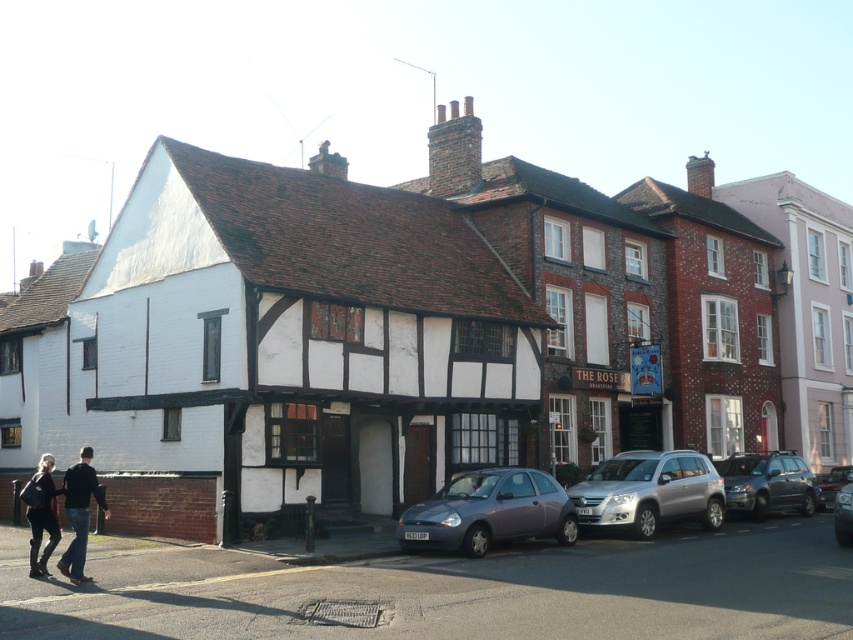
Can you confirm if metallic gray hatchback at center is bigger than metallic silver car at center right?

No, metallic gray hatchback at center is not bigger than metallic silver car at center right.

Is the position of metallic gray hatchback at center less distant than that of metallic silver car at center right?

That is True.

Is point (453, 522) farther from viewer compared to point (827, 497)?

No, (453, 522) is in front of (827, 497).

I want to click on metallic gray hatchback at center, so click(x=489, y=513).

How far apart are metallic gray hatchback at center and silver metallic suv at center?

They are 2.60 meters apart.

Who is more distant from viewer, (428, 499) or (700, 486)?

The point (428, 499) is more distant.

Which is in front, point (461, 516) or point (666, 467)?

Point (461, 516) is in front.

Identify the location of metallic gray hatchback at center. The height and width of the screenshot is (640, 853). (489, 513).

Does point (38, 515) lie in front of point (44, 465)?

Yes, it is in front of point (44, 465).

Is black leather jacket at lower left below dark gray fabric jacket at lower left?

No, black leather jacket at lower left is not below dark gray fabric jacket at lower left.

Which is in front, point (64, 508) or point (54, 488)?

Point (54, 488) is in front.

The image size is (853, 640). Identify the location of black leather jacket at lower left. tap(67, 515).